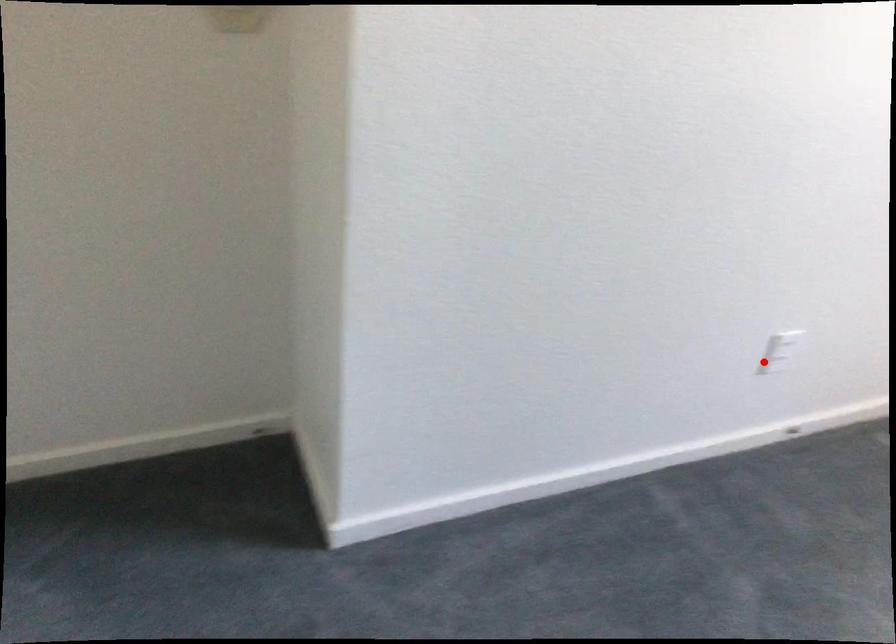
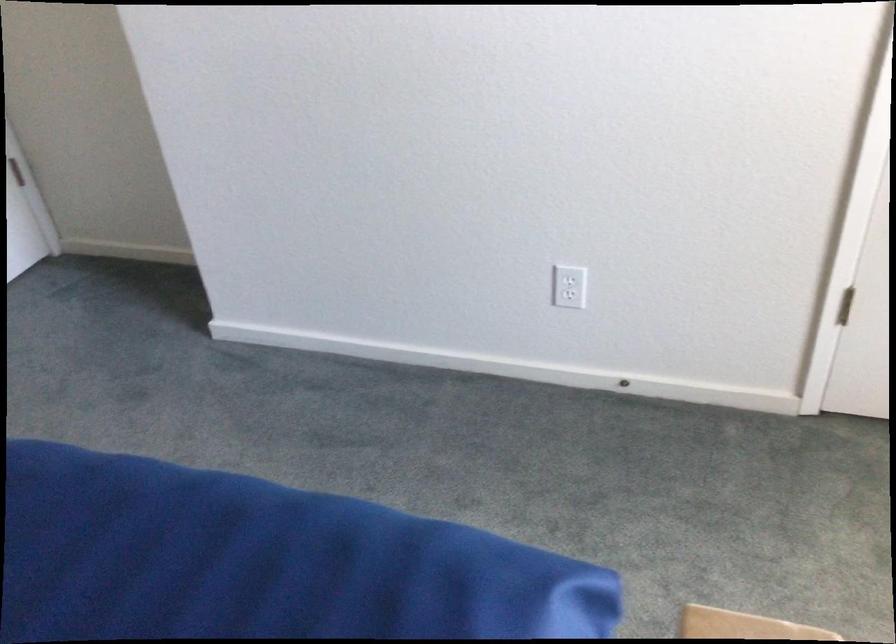
In the second image, find the point that corresponds to the highlighted location in the first image.

(569, 295)